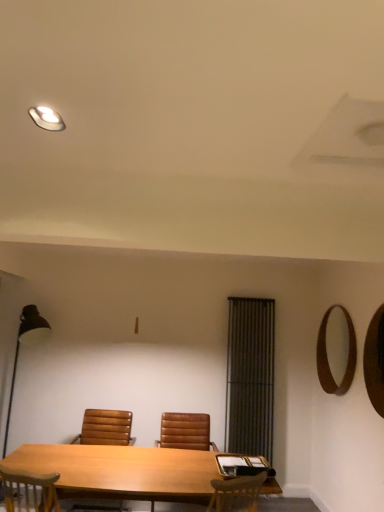
Question: Considering the relative sizes of matte white light fixture at upper left and wooden mirror at right, the second mirror from the back, in the image provided, is matte white light fixture at upper left smaller than wooden mirror at right, the second mirror from the back,?

Choices:
 (A) no
 (B) yes

Answer: (B)

Question: Can you confirm if matte white light fixture at upper left is positioned to the left of wooden mirror at right, the 1th mirror from the front?

Choices:
 (A) yes
 (B) no

Answer: (A)

Question: Does matte white light fixture at upper left have a lesser width compared to wooden mirror at right, the 1th mirror from the front?

Choices:
 (A) yes
 (B) no

Answer: (B)

Question: Does matte white light fixture at upper left contain wooden mirror at right, the 1th mirror from the front?

Choices:
 (A) yes
 (B) no

Answer: (B)

Question: Is matte white light fixture at upper left in front of wooden mirror at right, the 1th mirror from the front?

Choices:
 (A) yes
 (B) no

Answer: (A)

Question: Is matte white light fixture at upper left inside or outside of brown leather chair at center, arranged as the second chair when viewed from the right?

Choices:
 (A) inside
 (B) outside

Answer: (B)

Question: Considering the positions of point (41, 117) and point (125, 442), is point (41, 117) closer or farther from the camera than point (125, 442)?

Choices:
 (A) farther
 (B) closer

Answer: (B)

Question: Considering the relative positions of matte white light fixture at upper left and brown leather chair at center, placed as the first chair when sorted from left to right, in the image provided, is matte white light fixture at upper left to the left or to the right of brown leather chair at center, placed as the first chair when sorted from left to right,?

Choices:
 (A) left
 (B) right

Answer: (B)

Question: From a real-world perspective, is matte white light fixture at upper left physically located above or below brown leather chair at center, placed as the first chair when sorted from left to right?

Choices:
 (A) above
 (B) below

Answer: (A)

Question: From a real-world perspective, is brown leather chair at center, arranged as the second chair when viewed from the right, above or below brown leather chair at center, the first chair in the right-to-left sequence?

Choices:
 (A) above
 (B) below

Answer: (B)

Question: Is brown leather chair at center, arranged as the second chair when viewed from the right, taller or shorter than brown leather chair at center, arranged as the 2th chair when viewed from the left?

Choices:
 (A) tall
 (B) short

Answer: (B)

Question: From the image's perspective, is brown leather chair at center, arranged as the second chair when viewed from the right, located above or below brown leather chair at center, the first chair in the right-to-left sequence?

Choices:
 (A) above
 (B) below

Answer: (A)

Question: Is brown leather chair at center, arranged as the second chair when viewed from the right, inside or outside of brown leather chair at center, the first chair in the right-to-left sequence?

Choices:
 (A) outside
 (B) inside

Answer: (A)

Question: From the image's perspective, relative to brown wooden mirror at upper right, which is the first mirror from back to front, is black metal floor lamp at left above or below?

Choices:
 (A) below
 (B) above

Answer: (A)

Question: Is black metal floor lamp at left wider or thinner than brown wooden mirror at upper right, which ranks as the second mirror in front-to-back order?

Choices:
 (A) thin
 (B) wide

Answer: (B)